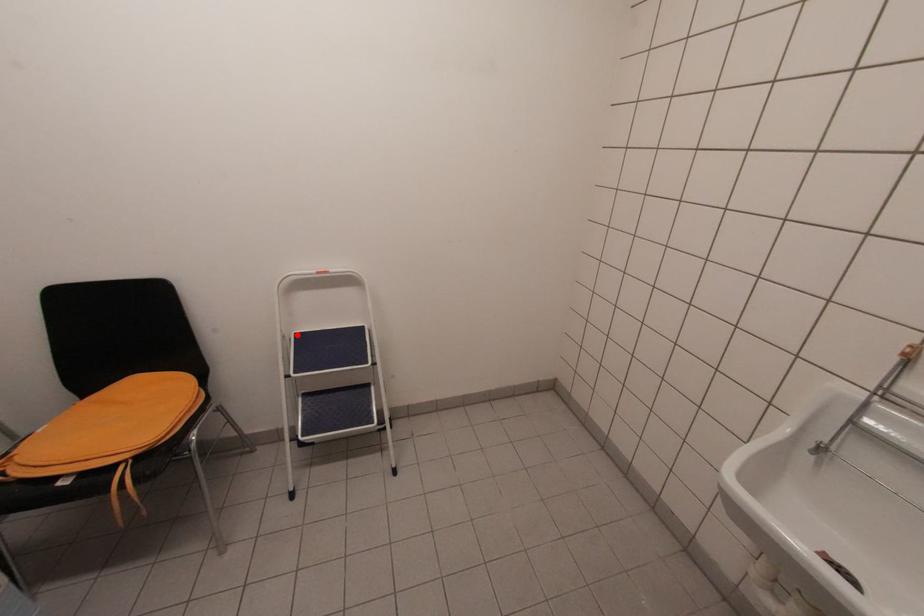
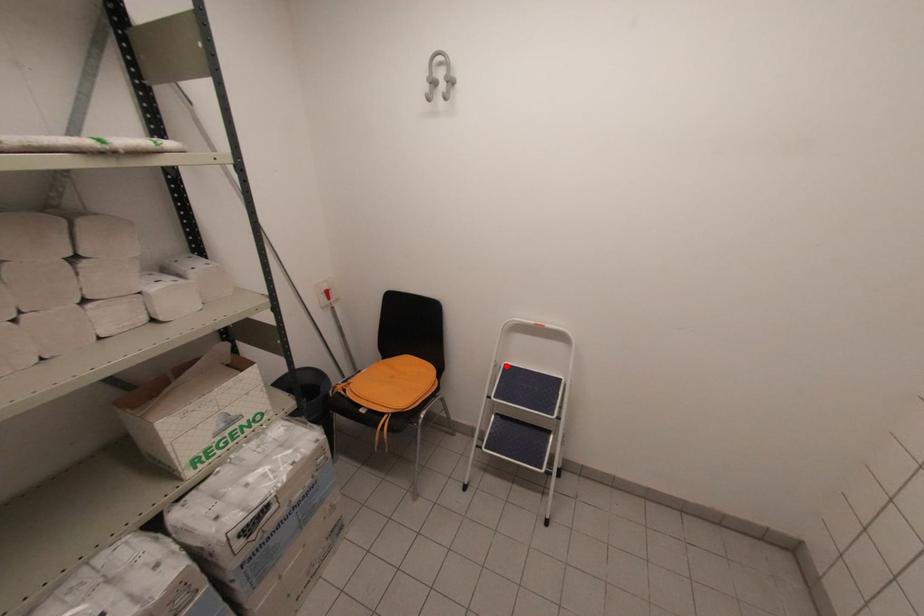
I am providing you with two images of the same scene from different viewpoints. A red point is marked on the first image and another point is marked on the second image. Is the red point in image1 aligned with the point shown in image2?

Yes